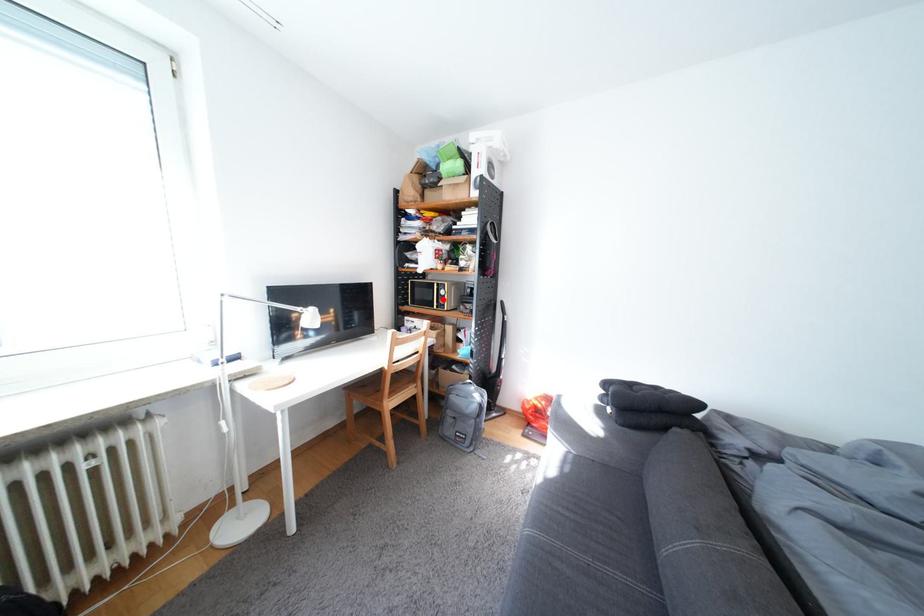
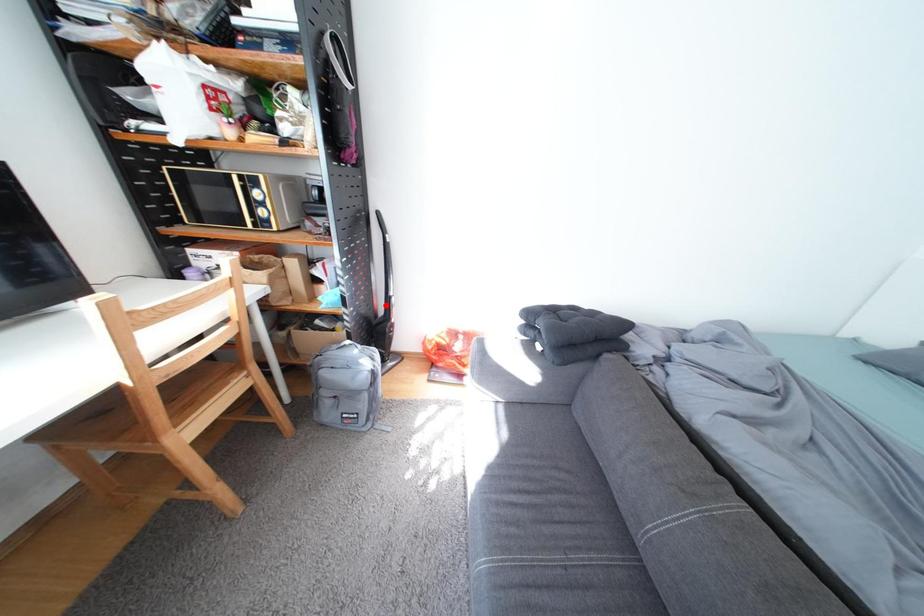
I am providing you with two images of the same scene from different viewpoints. A red point is marked on the first image and another point is marked on the second image. Do the highlighted points in image1 and image2 indicate the same real-world spot?

No